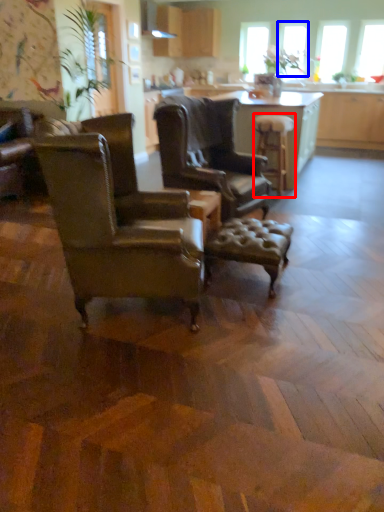
Question: Which object appears closest to the camera in this image, stool (highlighted by a red box) or window screen (highlighted by a blue box)?

Choices:
 (A) stool
 (B) window screen

Answer: (A)